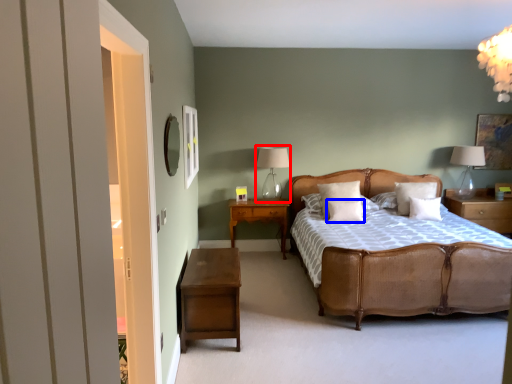
Question: Which of the following is the farthest to the observer, table lamp (highlighted by a red box) or pillow (highlighted by a blue box)?

Choices:
 (A) table lamp
 (B) pillow

Answer: (A)